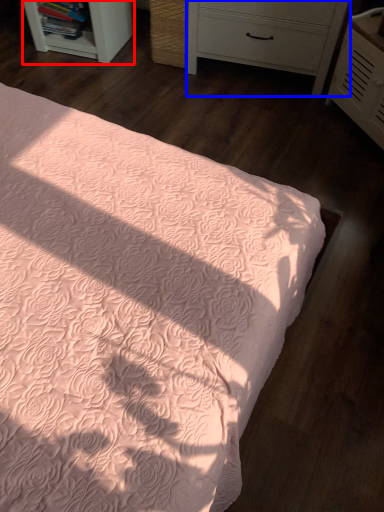
Question: Which object is further to the camera taking this photo, shelf (highlighted by a red box) or chest of drawers (highlighted by a blue box)?

Choices:
 (A) shelf
 (B) chest of drawers

Answer: (A)